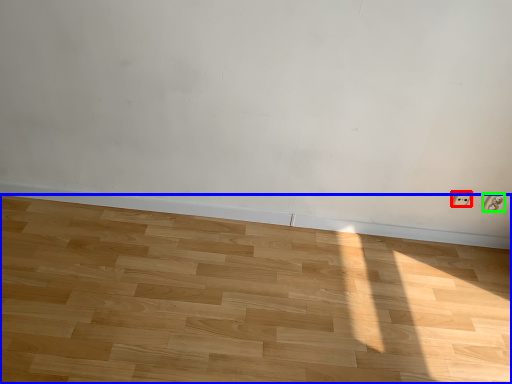
Question: Which is farther away from electric outlet (highlighted by a red box)? hardwood (highlighted by a blue box) or electric outlet (highlighted by a green box)?

Choices:
 (A) hardwood
 (B) electric outlet

Answer: (A)